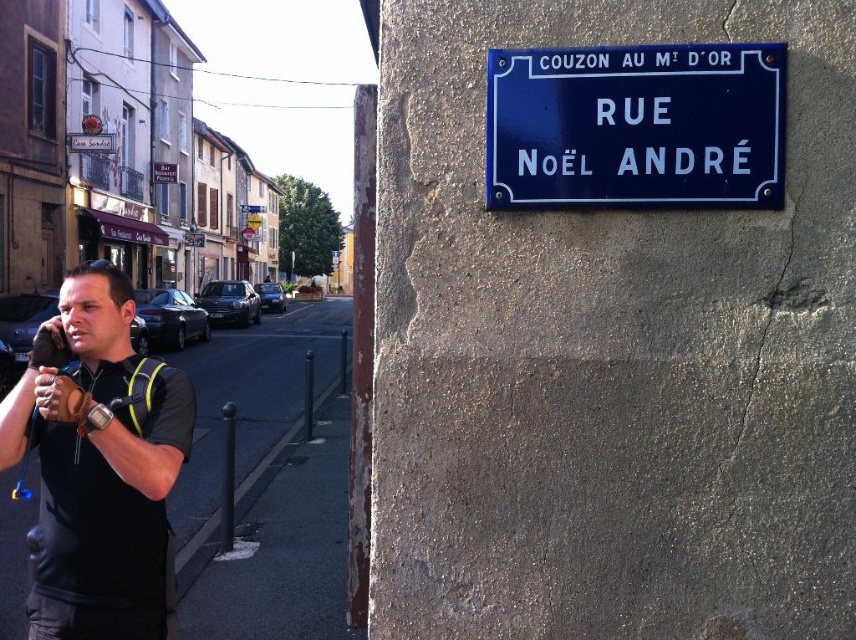
You are a photographer standing 10 feet away from the camera. You want to take a photo of the black fabric shirt at left without moving the shirt. Can you do it while staying at your current position?

The black fabric shirt at left and camera are 7.28 feet apart from each other. Since you are 10 feet away from the camera, the distance between you and the shirt is 10 feet plus 7.28 feet, totaling 17.28 feet. This distance may be too far for a clear photo without moving closer or using a telephoto lens.

You are standing at the center of the street and want to know where the black fabric shirt at left is located. Based on the coordinates provided, can you determine its position relative to the street?

The black fabric shirt at left is located at coordinates point [99,465], which places it on the left side of the street relative to the center.